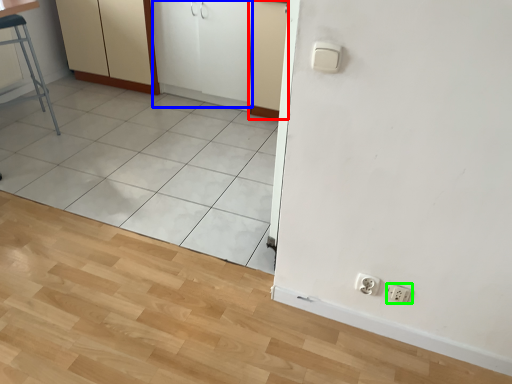
Question: Which object is the farthest from screen door (highlighted by a red box)? Choose among these: screen door (highlighted by a blue box) or socket (highlighted by a green box).

Choices:
 (A) screen door
 (B) socket

Answer: (B)